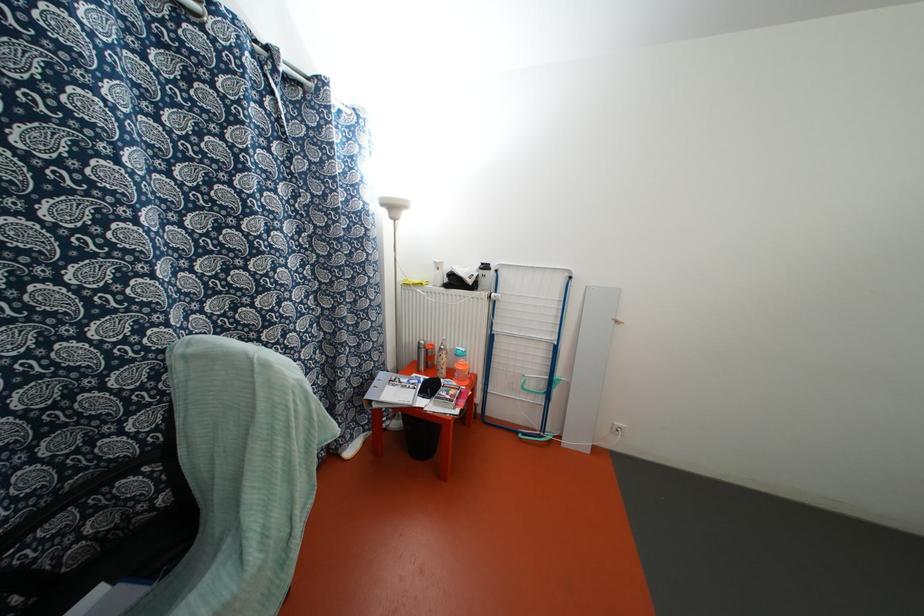
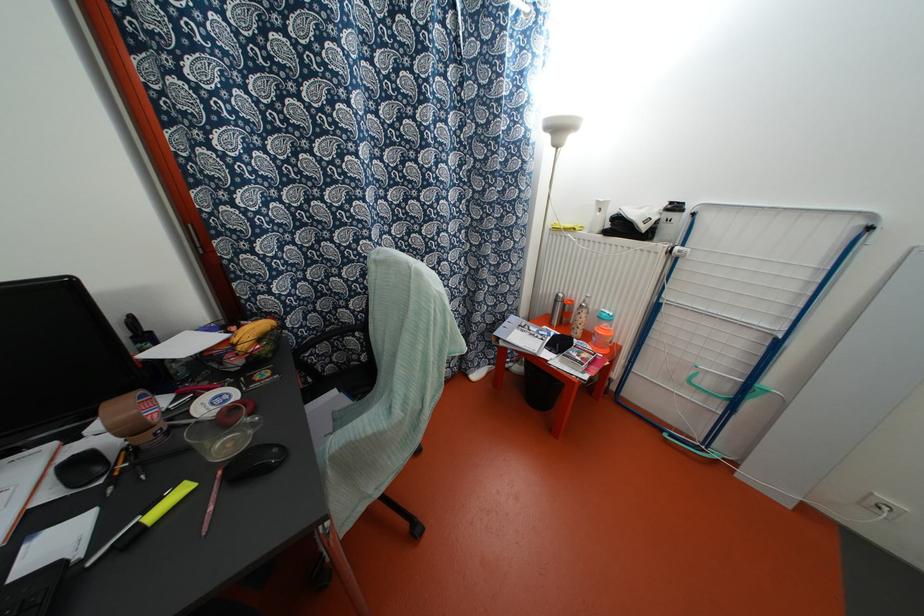
Locate, in the second image, the point that corresponds to point (444, 352) in the first image.

(584, 310)